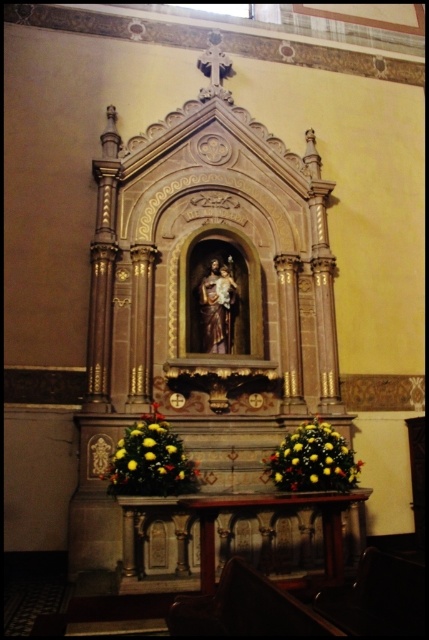
You are a visitor at the church and want to place a small candle between the two yellow floral arrangements. Which direction should you move from the yellow floral arrangement at center to reach the yellow floral arrangement at lower center?

The yellow floral arrangement at lower center is wider than the yellow floral arrangement at center. To place the candle between them, move downward from the yellow floral arrangement at center towards the wider one at lower center.